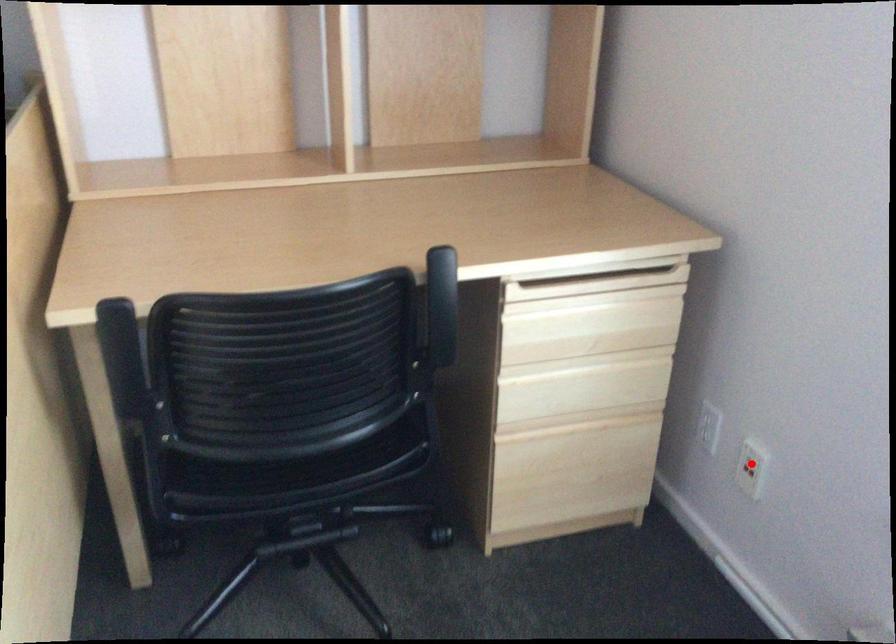
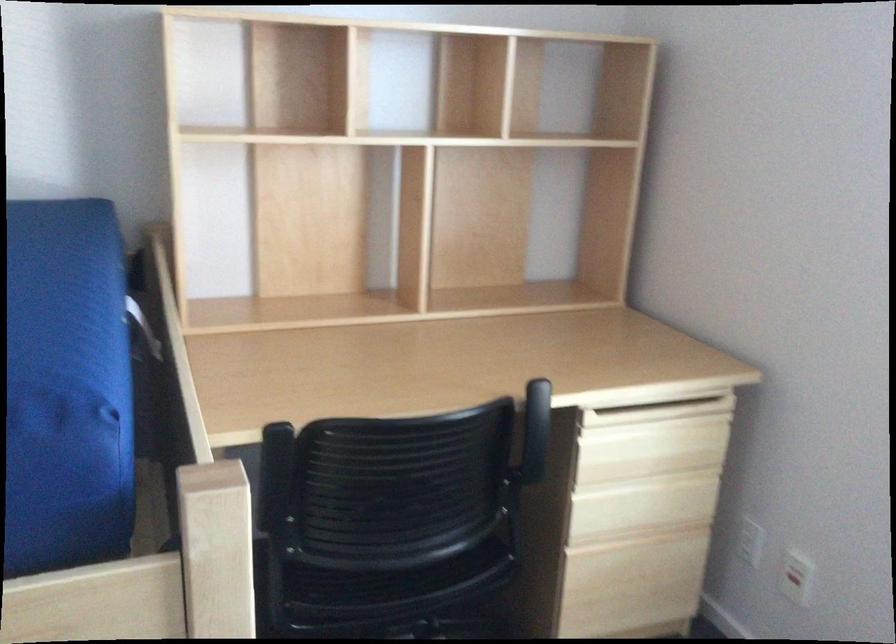
Locate, in the second image, the point that corresponds to the highlighted location in the first image.

(796, 576)